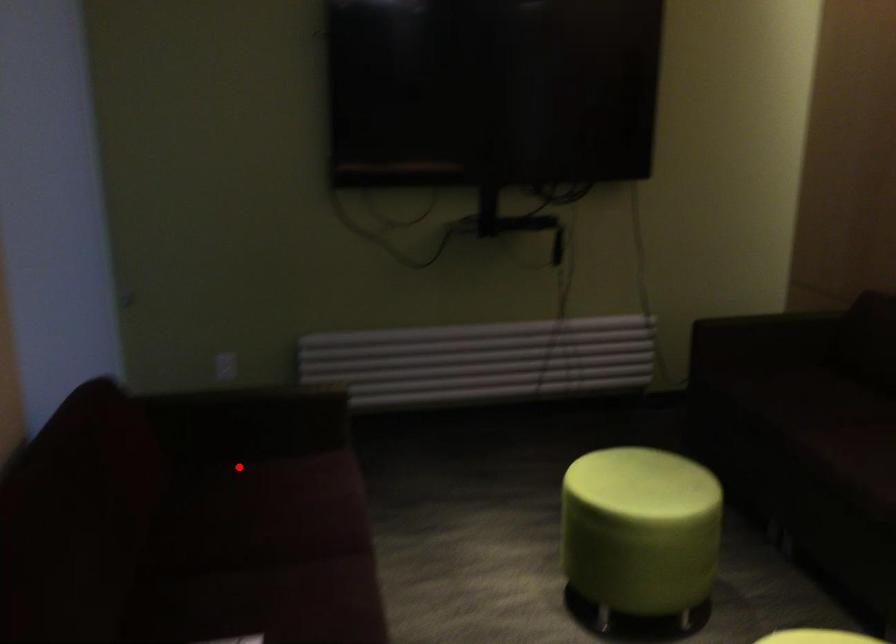
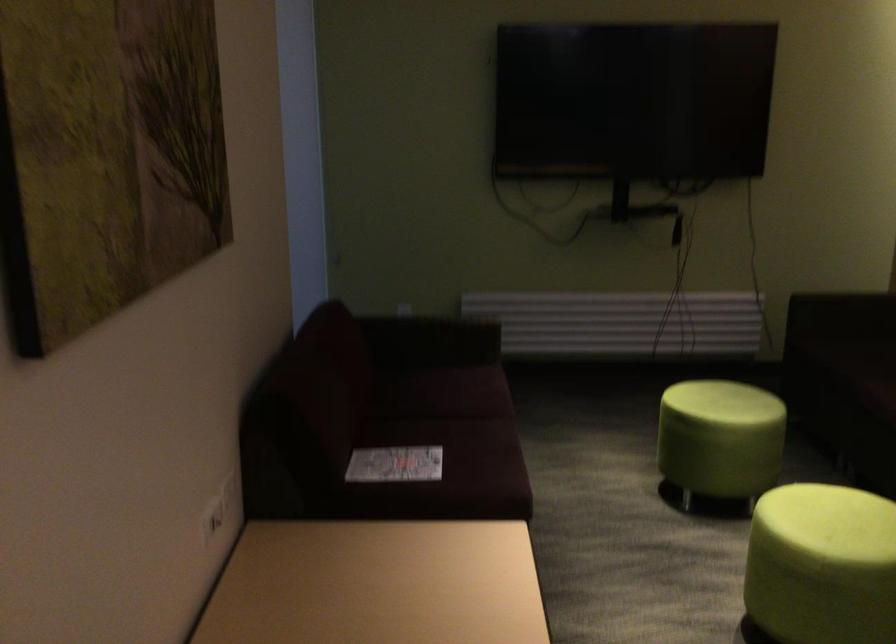
Question: I am providing you with two images of the same scene from different viewpoints. In image1, a red point is highlighted. Considering the same 3D point in image2, which of the following is correct?

Choices:
 (A) It is closer
 (B) It is farther

Answer: (B)